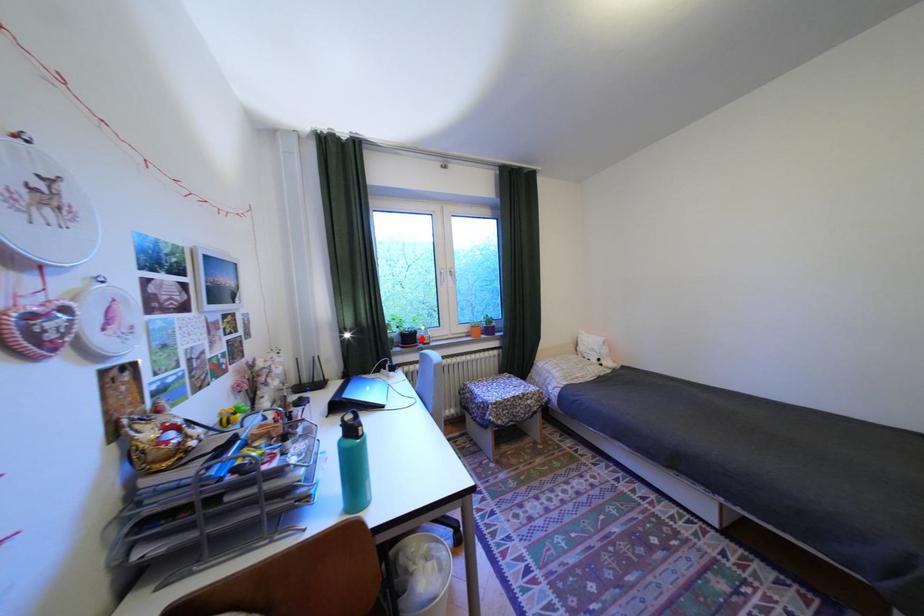
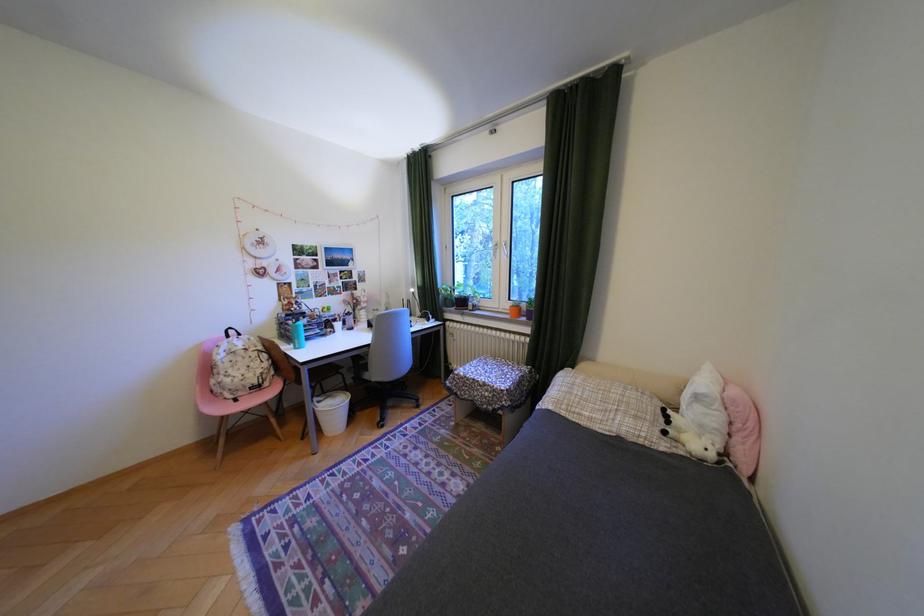
Where in the second image is the point corresponding to the highlighted location from the first image?

(475, 302)